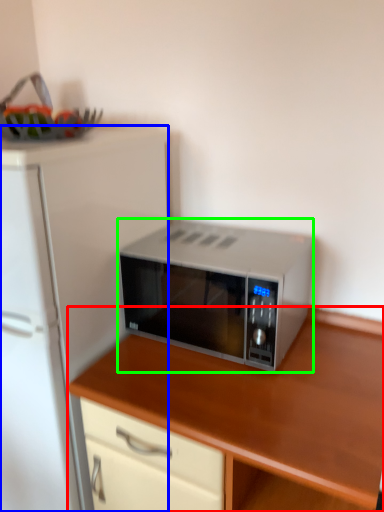
Question: Which object is positioned farthest from cabinetry (highlighted by a red box)? Select from refrigerator (highlighted by a blue box) and microwave oven (highlighted by a green box).

Choices:
 (A) refrigerator
 (B) microwave oven

Answer: (A)